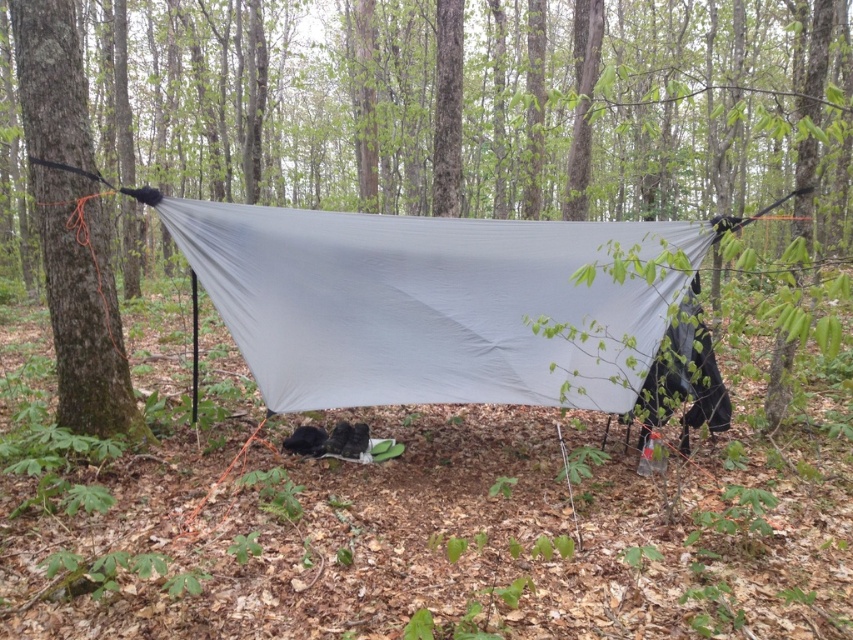
You are setting up a tent in the forest and need to choose between placing it under the green matte tarp at center or near the smooth bark tree at left. Based on their sizes, which location would provide more space for your tent?

The green matte tarp at center might be wider than smooth bark tree at left, so placing the tent under the green matte tarp at center could offer more space compared to the area near the smooth bark tree at left.

You are setting up a campsite in the forest and need to place a tent between the green matte tarp at center and the matte gray tarp at center. The tent requires 5 meters of space between the two tarps to be placed. Based on the scene description, can you determine if there is enough space to set up the tent between them?

The green matte tarp at center is 7.80 meters away from the matte gray tarp at center. Since the tent requires 5 meters of space, there is sufficient distance between them to place the tent.